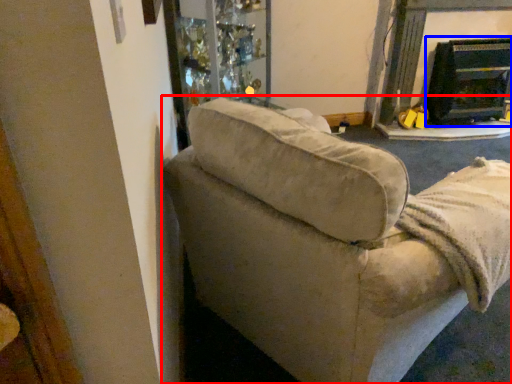
Question: Which point is closer to the camera, studio couch (highlighted by a red box) or fireplace (highlighted by a blue box)?

Choices:
 (A) studio couch
 (B) fireplace

Answer: (A)